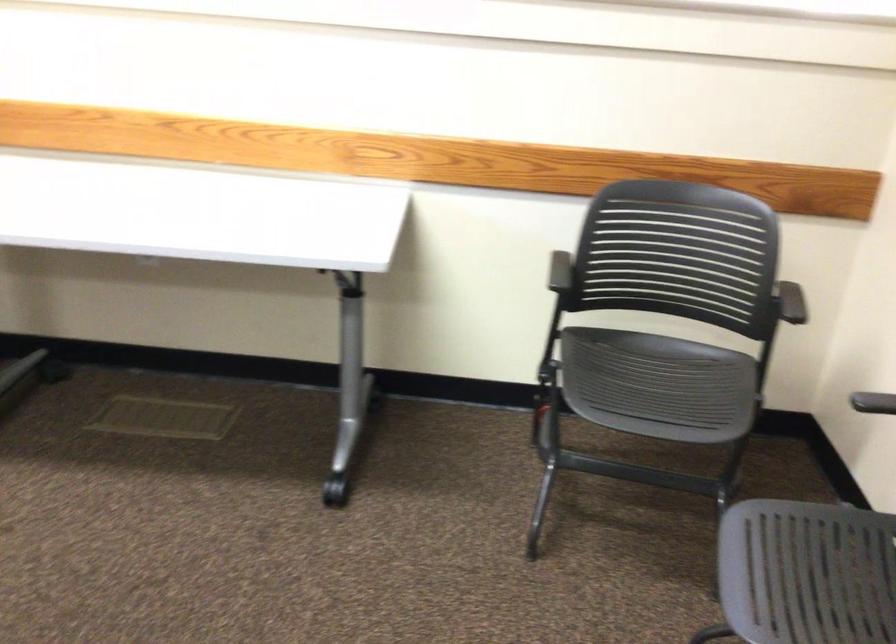
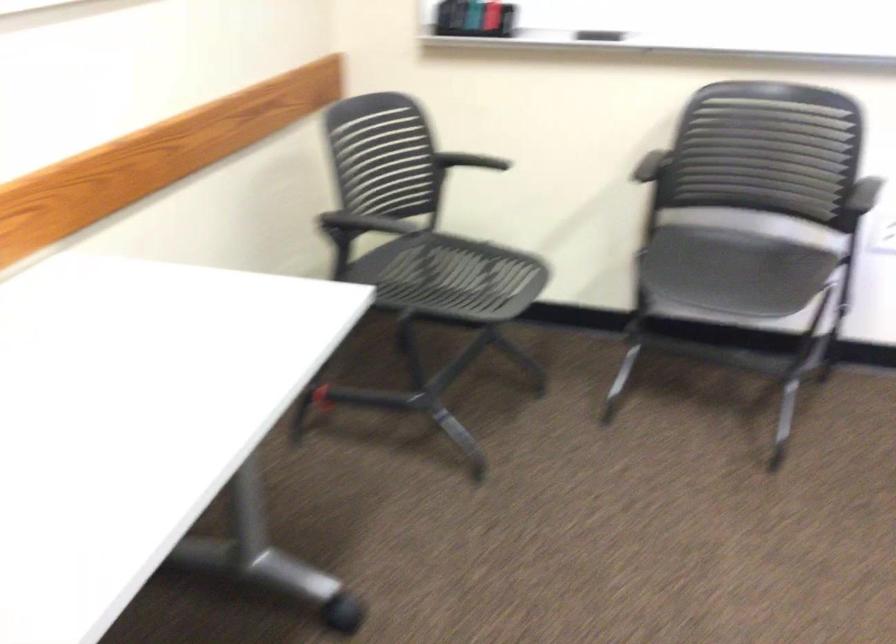
In the second image, find the point that corresponds to [780,299] in the first image.

(470, 161)